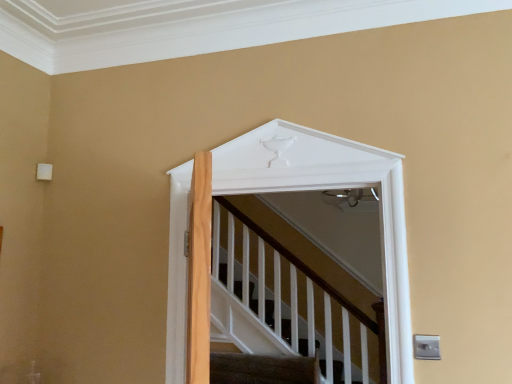
Question: Considering the relative sizes of carpeted stairs at lower center and white matte door at upper center in the image provided, is carpeted stairs at lower center shorter than white matte door at upper center?

Choices:
 (A) no
 (B) yes

Answer: (B)

Question: Does carpeted stairs at lower center have a larger size compared to white matte door at upper center?

Choices:
 (A) yes
 (B) no

Answer: (B)

Question: Is carpeted stairs at lower center closer to the viewer compared to white matte door at upper center?

Choices:
 (A) no
 (B) yes

Answer: (A)

Question: Is carpeted stairs at lower center smaller than white matte door at upper center?

Choices:
 (A) no
 (B) yes

Answer: (B)

Question: Is carpeted stairs at lower center not within white matte door at upper center?

Choices:
 (A) yes
 (B) no

Answer: (A)

Question: Does carpeted stairs at lower center have a greater height compared to white matte door at upper center?

Choices:
 (A) no
 (B) yes

Answer: (A)

Question: Can you confirm if white matte door at upper center is bigger than carpeted stairs at lower center?

Choices:
 (A) no
 (B) yes

Answer: (B)

Question: Is the position of white matte door at upper center more distant than that of carpeted stairs at lower center?

Choices:
 (A) yes
 (B) no

Answer: (B)

Question: From a real-world perspective, is white matte door at upper center physically below carpeted stairs at lower center?

Choices:
 (A) no
 (B) yes

Answer: (A)

Question: Can you confirm if white matte door at upper center is positioned to the right of carpeted stairs at lower center?

Choices:
 (A) no
 (B) yes

Answer: (B)

Question: Are white matte door at upper center and carpeted stairs at lower center located far from each other?

Choices:
 (A) no
 (B) yes

Answer: (B)

Question: Does white matte door at upper center come in front of carpeted stairs at lower center?

Choices:
 (A) yes
 (B) no

Answer: (A)

Question: Is white matte door at upper center inside the boundaries of carpeted stairs at lower center, or outside?

Choices:
 (A) outside
 (B) inside

Answer: (A)